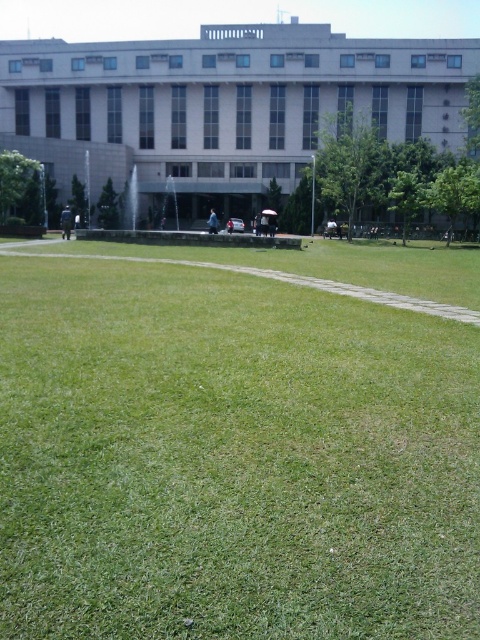
Question: Can you confirm if green grassy field at center is bigger than white concrete building at upper center?

Choices:
 (A) yes
 (B) no

Answer: (B)

Question: Among these points, which one is farthest from the camera?

Choices:
 (A) (16, 296)
 (B) (15, 65)

Answer: (B)

Question: Can you confirm if green grassy field at center is positioned to the right of white concrete building at upper center?

Choices:
 (A) no
 (B) yes

Answer: (B)

Question: Which point is farther to the camera?

Choices:
 (A) (464, 129)
 (B) (430, 618)

Answer: (A)

Question: Does green grassy field at center appear over white concrete building at upper center?

Choices:
 (A) yes
 (B) no

Answer: (B)

Question: Among these objects, which one is farthest from the camera?

Choices:
 (A) green grassy field at center
 (B) white concrete building at upper center

Answer: (B)